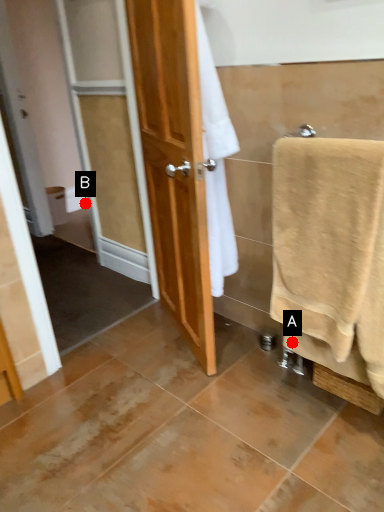
Question: Two points are circled on the image, labeled by A and B beside each circle. Which point is closer to the camera?

Choices:
 (A) A is closer
 (B) B is closer

Answer: (A)